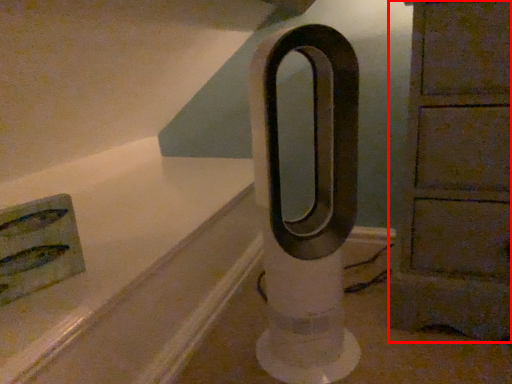
Question: From the image's perspective, what is the correct spatial positioning of furniture (annotated by the red box) in reference to pillar?

Choices:
 (A) above
 (B) below

Answer: (A)